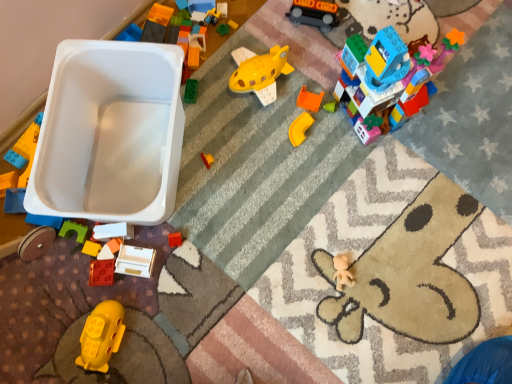
This screenshot has height=384, width=512. I want to click on free location in front of white plastic toy car at upper left, so click(138, 292).